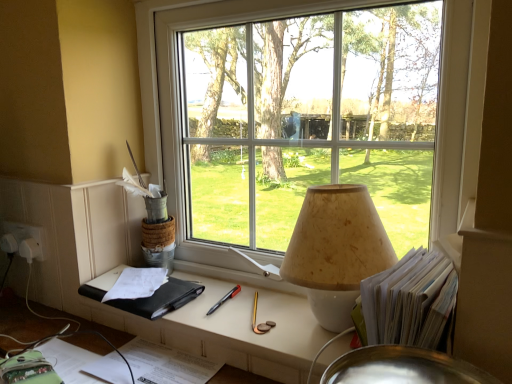
Question: From the image's perspective, is black leather notebook at lower left above or below transparent glass window at center?

Choices:
 (A) above
 (B) below

Answer: (B)

Question: From a real-world perspective, is black leather notebook at lower left positioned above or below transparent glass window at center?

Choices:
 (A) below
 (B) above

Answer: (A)

Question: Which is farther from the matte black book at center?

Choices:
 (A) transparent glass window at center
 (B) white paper stack at right
 (C) black leather notebook at lower left
 (D) beige textured lampshade at center

Answer: (A)

Question: Considering the real-world distances, which object is closest to the black leather notebook at lower left?

Choices:
 (A) transparent glass window at center
 (B) white paper stack at right
 (C) matte black book at center
 (D) beige textured lampshade at center

Answer: (C)